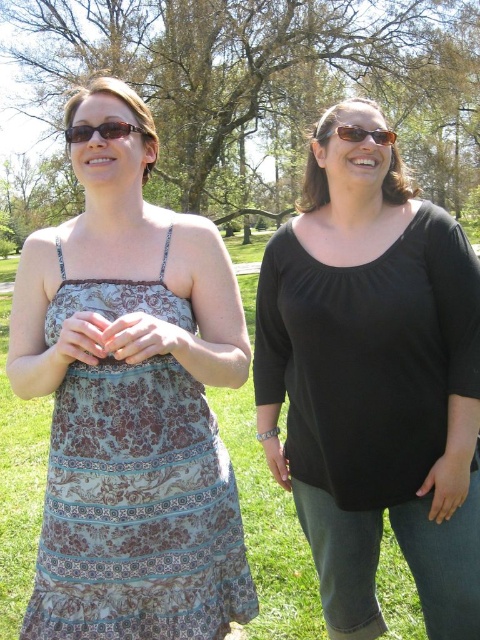
Question: Is black matte top at center to the left of matte brown sunglasses at upper center from the viewer's perspective?

Choices:
 (A) yes
 (B) no

Answer: (B)

Question: Which point appears farthest from the camera in this image?

Choices:
 (A) (88, 124)
 (B) (47, 612)

Answer: (A)

Question: Can you confirm if printed fabric dress at center is thinner than matte black sunglasses at upper left?

Choices:
 (A) no
 (B) yes

Answer: (A)

Question: Among these objects, which one is nearest to the camera?

Choices:
 (A) printed fabric dress at center
 (B) matte black sunglasses at upper left
 (C) black matte top at center
 (D) matte brown sunglasses at upper center

Answer: (A)

Question: Which object appears farthest from the camera in this image?

Choices:
 (A) matte black sunglasses at upper left
 (B) black matte top at center
 (C) matte brown sunglasses at upper center
 (D) printed fabric dress at center

Answer: (C)

Question: Can you confirm if matte black sunglasses at upper left is smaller than matte brown sunglasses at upper center?

Choices:
 (A) yes
 (B) no

Answer: (A)